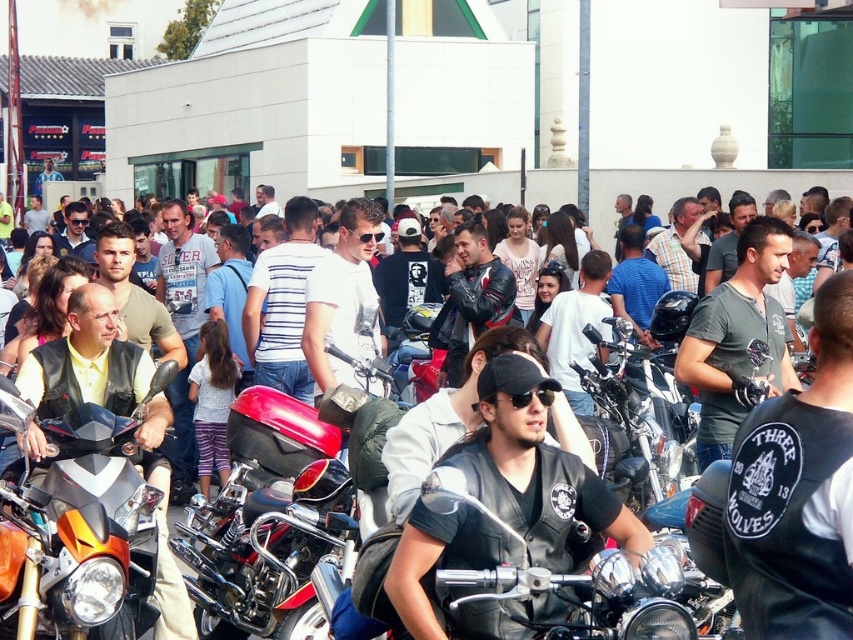
Question: Based on their relative distances, which object is farther from the shiny chrome motorcycle at center?

Choices:
 (A) shiny red motorcycle at center
 (B) orange matte motorcycle at center
 (C) leather jacket at center

Answer: (C)

Question: Is leather jacket at center thinner than shiny red motorcycle at center?

Choices:
 (A) yes
 (B) no

Answer: (A)

Question: Can you confirm if leather jacket at center is positioned to the left of shiny chrome motorcycle at center?

Choices:
 (A) yes
 (B) no

Answer: (A)

Question: Which point appears closest to the camera in this image?

Choices:
 (A) (692, 461)
 (B) (247, 627)
 (C) (529, 390)

Answer: (C)

Question: Which point is farther to the camera?

Choices:
 (A) shiny chrome motorcycle at center
 (B) shiny red motorcycle at center

Answer: (A)

Question: Can you confirm if orange matte motorcycle at center is thinner than shiny chrome motorcycle at center?

Choices:
 (A) yes
 (B) no

Answer: (B)